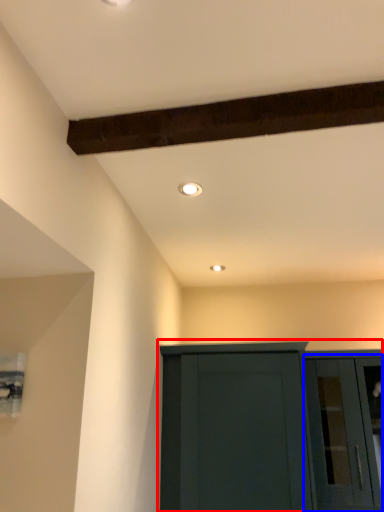
Question: Which object is closer to the camera taking this photo, cupboard (highlighted by a red box) or glass door (highlighted by a blue box)?

Choices:
 (A) cupboard
 (B) glass door

Answer: (A)